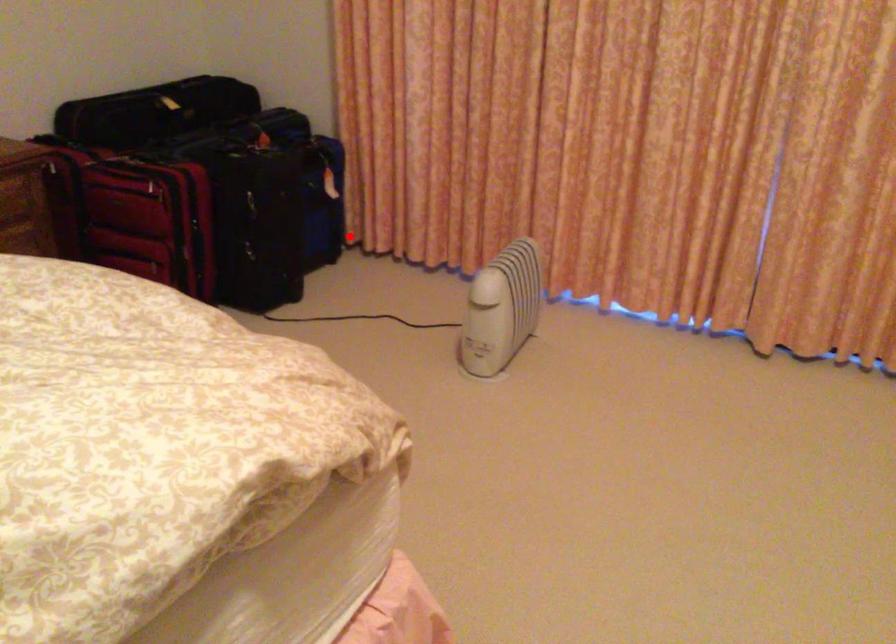
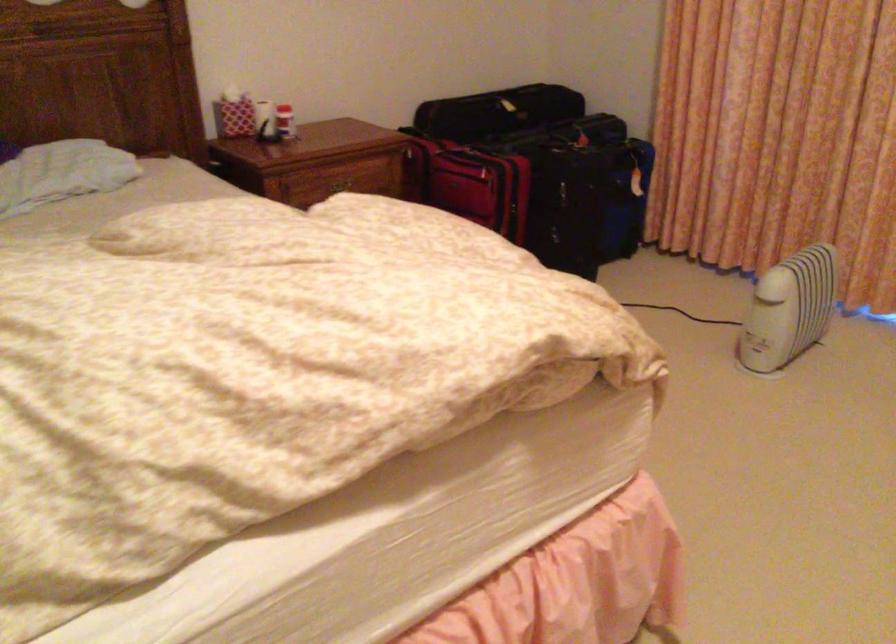
Locate, in the second image, the point that corresponds to the highlighted location in the first image.

(649, 223)